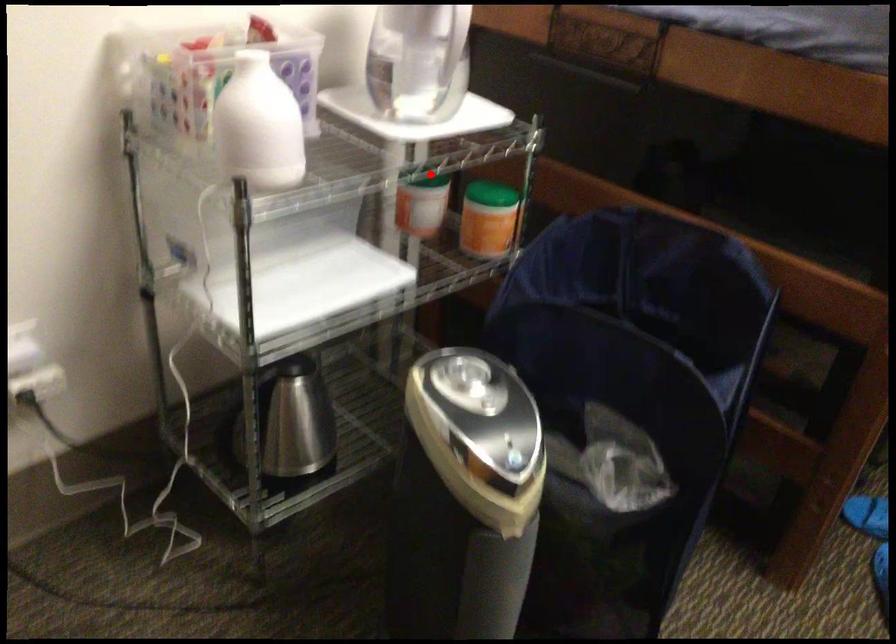
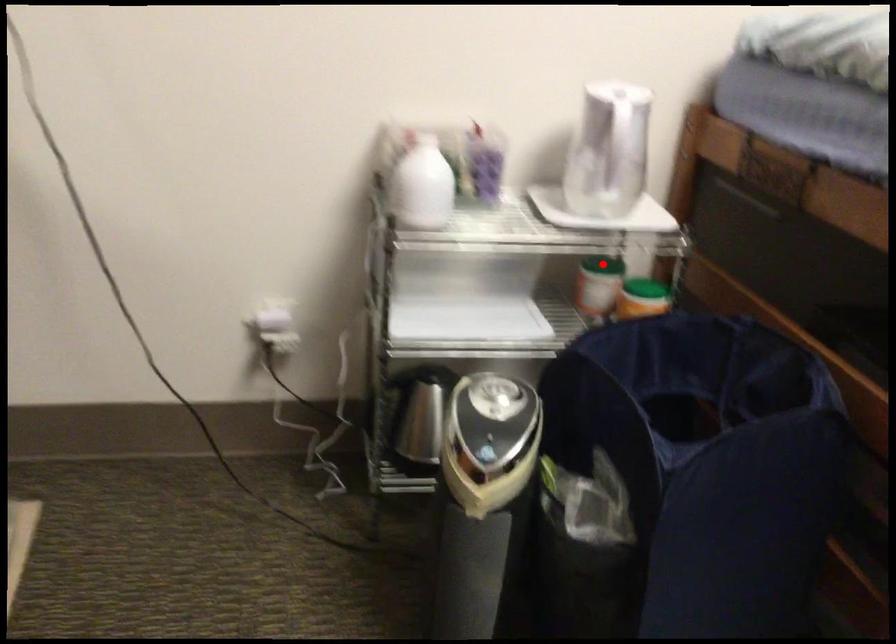
I am providing you with two images of the same scene from different viewpoints. A red point is marked on the first image and another point is marked on the second image. Does the point marked in image1 correspond to the same location as the one in image2?

Yes